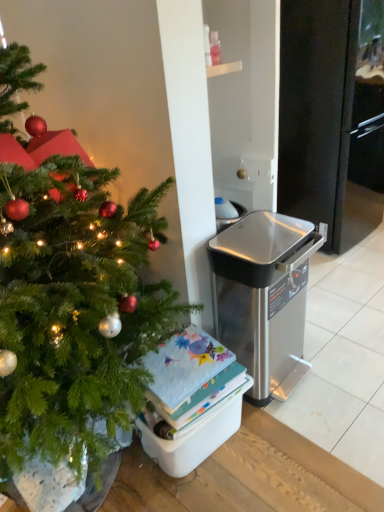
What do you see at coordinates (263, 295) in the screenshot? I see `satin silver trash can at lower right` at bounding box center [263, 295].

Locate an element on the screen. satin silver trash can at lower right is located at coordinates (263, 295).

Measure the distance between satin silver trash can at lower right and camera.

They are 4.60 feet apart.

Find the location of a particular element. The width and height of the screenshot is (384, 512). satin silver trash can at lower right is located at coordinates (263, 295).